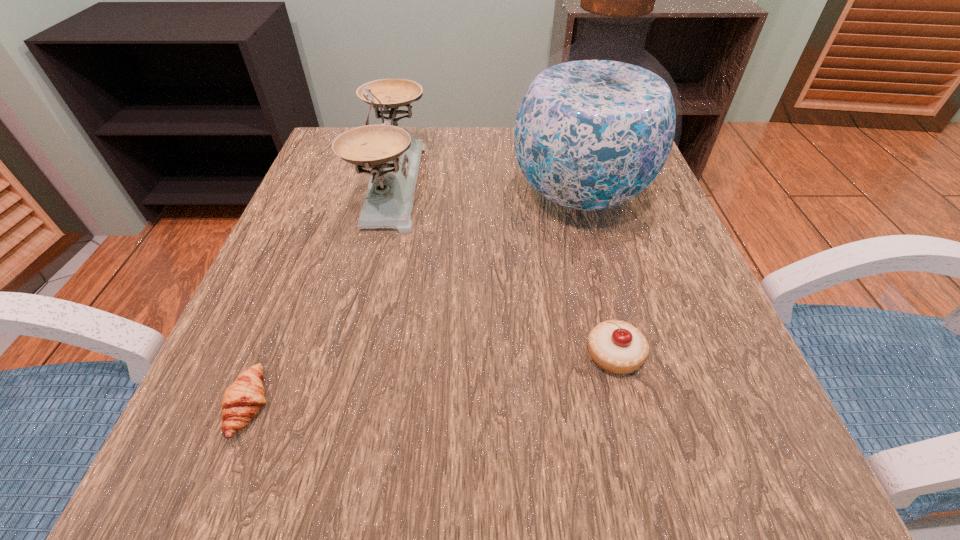
Locate an element on the screen. The image size is (960, 540). vacant position located 0.190m on the front-facing side of the left pastry is located at coordinates (412, 405).

You are a GUI agent. You are given a task and a screenshot of the screen. Output one action in this format:
    pyautogui.click(x=<x>, y=<y>)
    Task: Click on the water jug at the far edge
    
    Given the screenshot: What is the action you would take?
    pyautogui.click(x=595, y=127)

Find the location of `scale that is at the far edge`. scale that is at the far edge is located at coordinates (394, 155).

At what (x,y) coordinates should I click in order to perform the action: click on object situated at the near edge. Please return your answer as a coordinate pair (x, y). This screenshot has width=960, height=540. Looking at the image, I should click on (241, 402).

Identify the location of scale situated at the left edge. This screenshot has width=960, height=540. [x=394, y=155].

What are the coordinates of `pastry located in the left edge section of the desktop` in the screenshot? It's located at (241, 402).

Identify the location of water jug present at the right edge. (595, 127).

Locate an element on the screen. pastry located in the right edge section of the desktop is located at coordinates (617, 347).

Where is `object that is at the far left corner`? object that is at the far left corner is located at coordinates (394, 155).

Where is `object that is at the near left corner`? This screenshot has width=960, height=540. object that is at the near left corner is located at coordinates (241, 402).